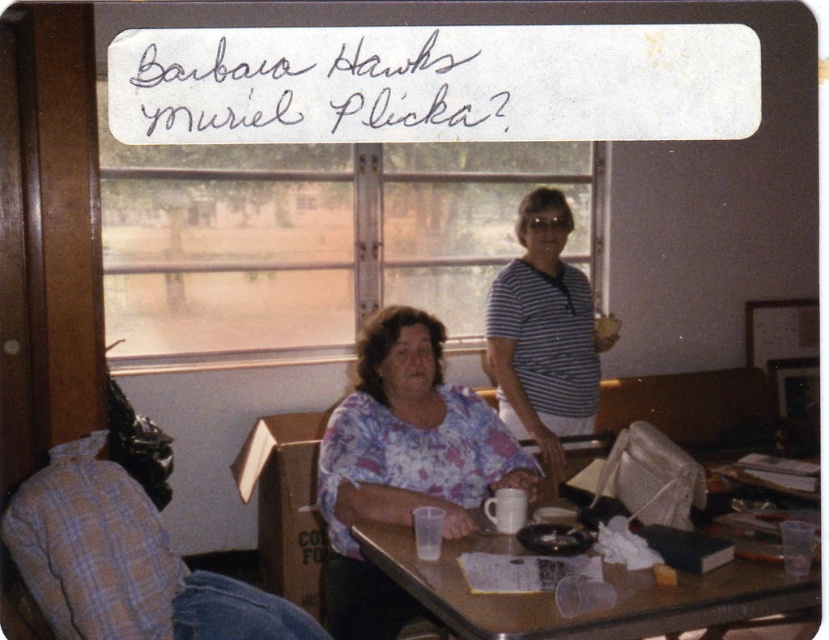
You are sitting at the wooden table at center and want to reach for the striped cotton shirt at center. Can you do this without moving from your seat?

The wooden table at center is in front of the striped cotton shirt at center, so you cannot reach it without moving from your seat because the table is blocking the way.

Looking at this image, you are sitting at the wooden table at center and want to hand a napkin to the person wearing the floral fabric blouse at center. Can you reach them directly without moving around the table?

The floral fabric blouse at center is closer to you than the wooden table at center, so yes, you can reach them directly since they are in front of you and not blocked by the table.

You are sitting at the wooden table at center and want to reach the striped cotton shirt at center. In which direction should you move to get closer to the shirt?

The wooden table at center is positioned on the left side of striped cotton shirt at center. To get closer to the shirt, you should move to the right.